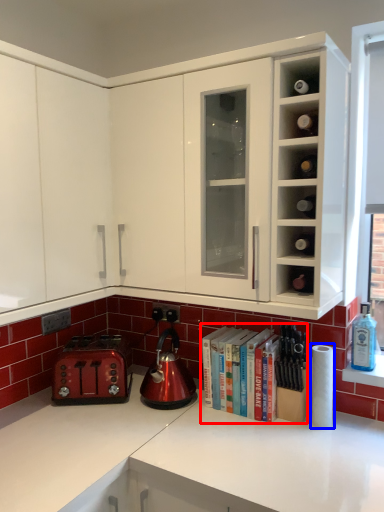
Question: Which object appears farthest to the camera in this image, book (highlighted by a red box) or paper towel (highlighted by a blue box)?

Choices:
 (A) book
 (B) paper towel

Answer: (A)